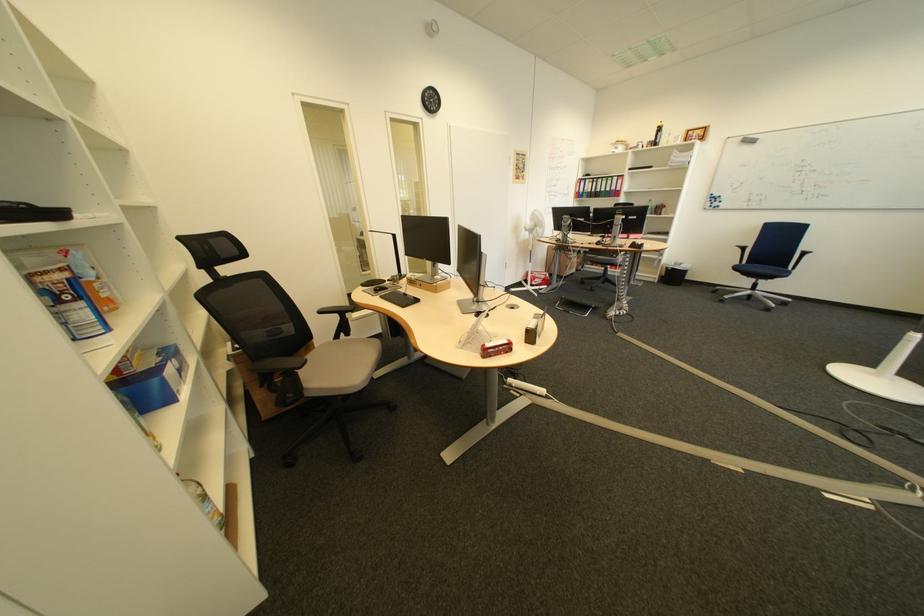
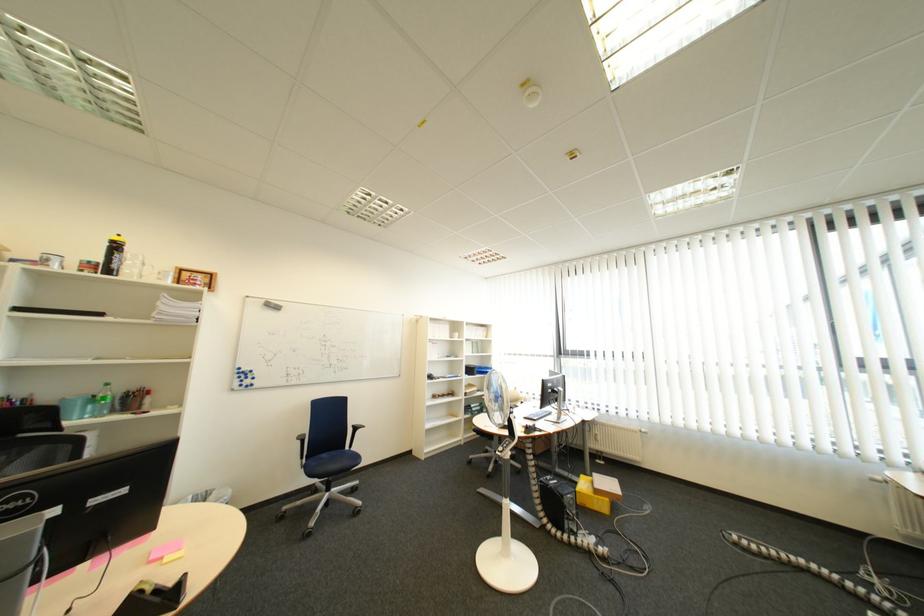
Where in the second image is the point corresponding to [686,160] from the first image?

(175, 309)